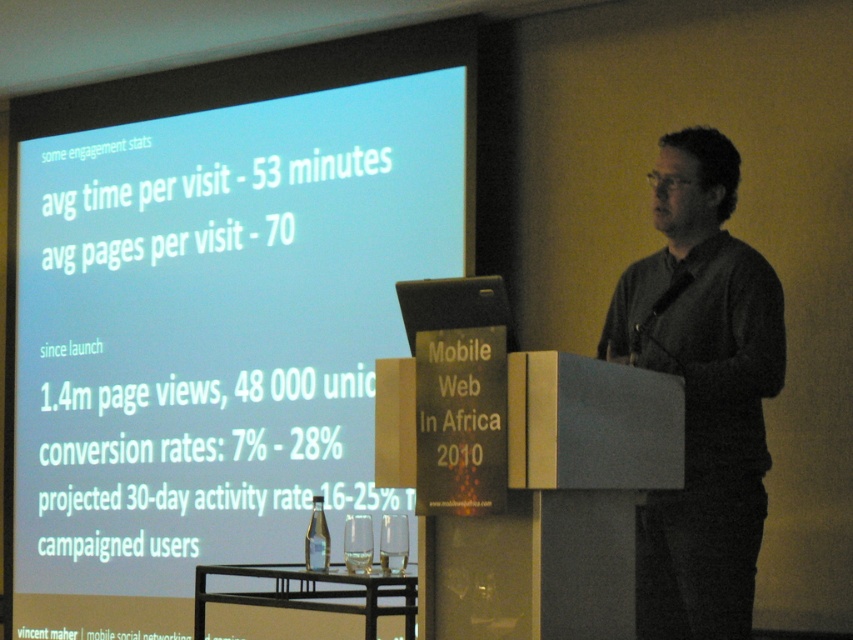
You are sitting in the front row of the presentation hall. You want to look at the dark gray sweater at center and then glance at the white matte projection screen at upper left. Which object will require you to look upward more?

The white matte projection screen at upper left is positioned higher than the dark gray sweater at center, so you will need to look upward more to see the white matte projection screen at upper left.